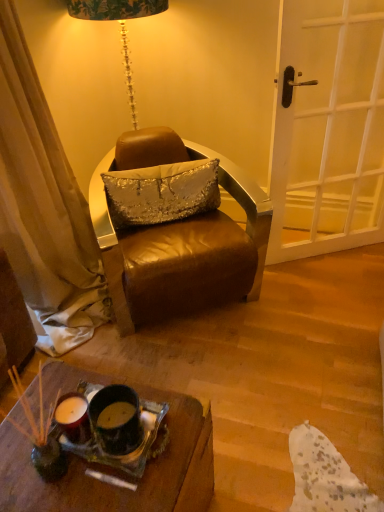
Identify the location of white wooden door at right. This screenshot has width=384, height=512. (329, 128).

Can you see white wooden door at right touching silver sequined pillow at center?

No, white wooden door at right is not touching silver sequined pillow at center.

From a real-world perspective, is white wooden door at right positioned above or below silver sequined pillow at center?

In terms of real-world spatial position, white wooden door at right is above silver sequined pillow at center.

Considering the relative sizes of white wooden door at right and silver sequined pillow at center in the image provided, is white wooden door at right bigger than silver sequined pillow at center?

Yes, white wooden door at right is bigger than silver sequined pillow at center.

From the image's perspective, would you say white wooden door at right is positioned over silver sequined pillow at center?

Yes, from the image's perspective, white wooden door at right is on top of silver sequined pillow at center.

Is leather chair at center at the left side of translucent glass tray at lower center?

In fact, leather chair at center is to the right of translucent glass tray at lower center.

Is leather chair at center not near translucent glass tray at lower center?

No, leather chair at center is not far from translucent glass tray at lower center.

Is leather chair at center bigger than translucent glass tray at lower center?

Yes, leather chair at center is bigger than translucent glass tray at lower center.

Is white wooden door at right to the right of leather chair at center from the viewer's perspective?

Indeed, white wooden door at right is positioned on the right side of leather chair at center.

Is white wooden door at right far away from leather chair at center?

white wooden door at right is near leather chair at center, not far away.

Find the location of `door located on the right of leather chair at center`. door located on the right of leather chair at center is located at coordinates (329, 128).

Can you confirm if white wooden door at right is bigger than leather chair at center?

No, white wooden door at right is not bigger than leather chair at center.

Based on the photo, from the image's perspective, would you say silver sequined pillow at center is shown under translucent glass tray at lower center?

Incorrect, from the image's perspective, silver sequined pillow at center is higher than translucent glass tray at lower center.

Considering the relative positions of silver sequined pillow at center and translucent glass tray at lower center in the image provided, is silver sequined pillow at center to the left of translucent glass tray at lower center from the viewer's perspective?

No, silver sequined pillow at center is not to the left of translucent glass tray at lower center.

From their relative heights in the image, would you say silver sequined pillow at center is taller or shorter than translucent glass tray at lower center?

Clearly, silver sequined pillow at center is taller compared to translucent glass tray at lower center.

Based on the photo, considering the sizes of objects silver sequined pillow at center and translucent glass tray at lower center in the image provided, who is smaller, silver sequined pillow at center or translucent glass tray at lower center?

With smaller size is translucent glass tray at lower center.

Identify the location of door above the translucent glass tray at lower center (from the image's perspective). (329, 128).

Based on their sizes in the image, would you say white wooden door at right is bigger or smaller than translucent glass tray at lower center?

Considering their sizes, white wooden door at right takes up more space than translucent glass tray at lower center.

From the image's perspective, between white wooden door at right and translucent glass tray at lower center, who is located below?

translucent glass tray at lower center.

How many degrees apart are the facing directions of translucent glass tray at lower center and leather chair at center?

There is a 52.6-degree angle between the facing directions of translucent glass tray at lower center and leather chair at center.

From the image's perspective, would you say translucent glass tray at lower center is positioned over leather chair at center?

Actually, translucent glass tray at lower center appears below leather chair at center in the image.

Is point (174, 406) farther from viewer compared to point (223, 291)?

No, (174, 406) is in front of (223, 291).

Is translucent glass tray at lower center further to the viewer compared to leather chair at center?

That is False.

Can you confirm if silver sequined pillow at center is wider than white wooden door at right?

Yes, silver sequined pillow at center is wider than white wooden door at right.

What are the coordinates of `door in front of the silver sequined pillow at center` in the screenshot? It's located at (329, 128).

Between silver sequined pillow at center and white wooden door at right, which one appears on the left side from the viewer's perspective?

From the viewer's perspective, silver sequined pillow at center appears more on the left side.

Would you say silver sequined pillow at center is outside white wooden door at right?

Yes, silver sequined pillow at center is not within white wooden door at right.

Where is `pillow behind the white wooden door at right`? This screenshot has height=512, width=384. pillow behind the white wooden door at right is located at coordinates (161, 192).

Image resolution: width=384 pixels, height=512 pixels. Identify the location of desk above the leather chair at center (from a real-world perspective). (119, 471).

When comparing their distances from leather chair at center, does white wooden door at right or translucent glass tray at lower center seem closer?

white wooden door at right lies closer to leather chair at center than the other object.

Based on their spatial positions, is leather chair at center or translucent glass tray at lower center closer to white wooden door at right?

leather chair at center is closer to white wooden door at right.

Which object lies nearer to the anchor point translucent glass tray at lower center, leather chair at center or silver sequined pillow at center?

leather chair at center lies closer to translucent glass tray at lower center than the other object.

Which object lies further to the anchor point leather chair at center, translucent glass tray at lower center or white wooden door at right?

translucent glass tray at lower center is positioned further to the anchor leather chair at center.

In the scene shown: Looking at the image, which one is located further to leather chair at center, silver sequined pillow at center or translucent glass tray at lower center?

Among the two, translucent glass tray at lower center is located further to leather chair at center.

Based on their spatial positions, is leather chair at center or translucent glass tray at lower center closer to silver sequined pillow at center?

leather chair at center is positioned closer to the anchor silver sequined pillow at center.

Which object lies further to the anchor point silver sequined pillow at center, leather chair at center or white wooden door at right?

Among the two, white wooden door at right is located further to silver sequined pillow at center.

When comparing their distances from translucent glass tray at lower center, does leather chair at center or white wooden door at right seem further?

white wooden door at right is further to translucent glass tray at lower center.

The height and width of the screenshot is (512, 384). What are the coordinates of `pillow between translucent glass tray at lower center and white wooden door at right in the horizontal direction` in the screenshot? It's located at (161, 192).

This screenshot has height=512, width=384. In order to click on chair located between silver sequined pillow at center and white wooden door at right in the left-right direction in this screenshot , I will do click(179, 240).

Where is `chair between translucent glass tray at lower center and silver sequined pillow at center along the z-axis`? This screenshot has height=512, width=384. chair between translucent glass tray at lower center and silver sequined pillow at center along the z-axis is located at coordinates (179, 240).

This screenshot has width=384, height=512. Identify the location of chair between translucent glass tray at lower center and white wooden door at right. (179, 240).